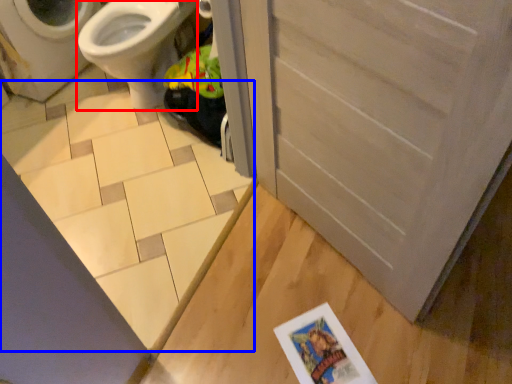
Question: Which object appears closest to the camera in this image, bidet (highlighted by a red box) or tile (highlighted by a blue box)?

Choices:
 (A) bidet
 (B) tile

Answer: (B)